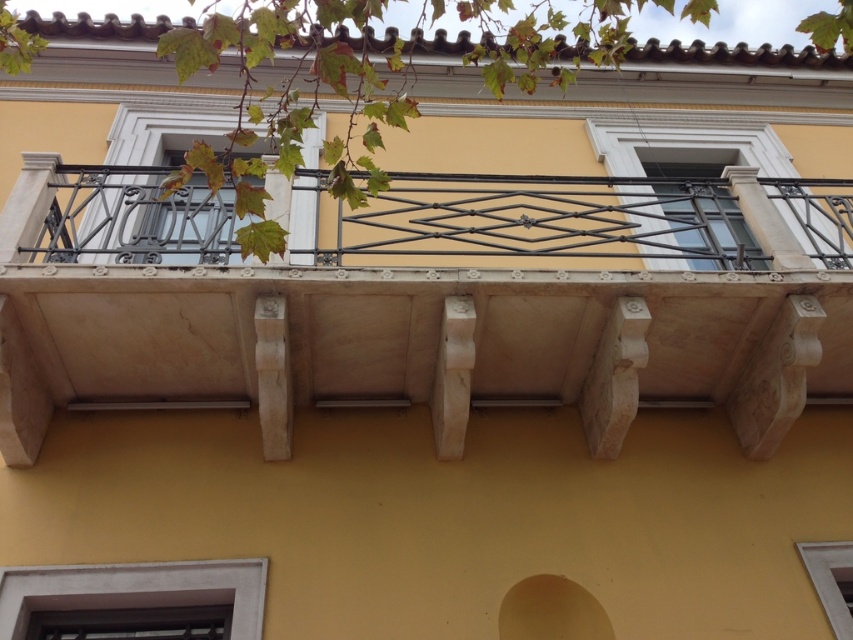
You are standing on the sidewalk in front of this building and want to look through the clear glass window at center. Will the metallic wrought iron at center block your view of the window?

The clear glass window at center is positioned under the metallic wrought iron at center, so the wrought iron will block part of your view of the window.

You are standing in front of the building and want to touch the metallic wrought iron at center and the white matte window at lower center. Which object can you reach first without moving your position?

You can reach the metallic wrought iron at center first because it is closer to you than the white matte window at lower center.

You are standing on the ground floor looking up at the building facade. You see the white marble balcony at center and the clear glass window at center. Which object is positioned higher up on the building?

The clear glass window at center is positioned higher up on the building since the white marble balcony at center is located below it.